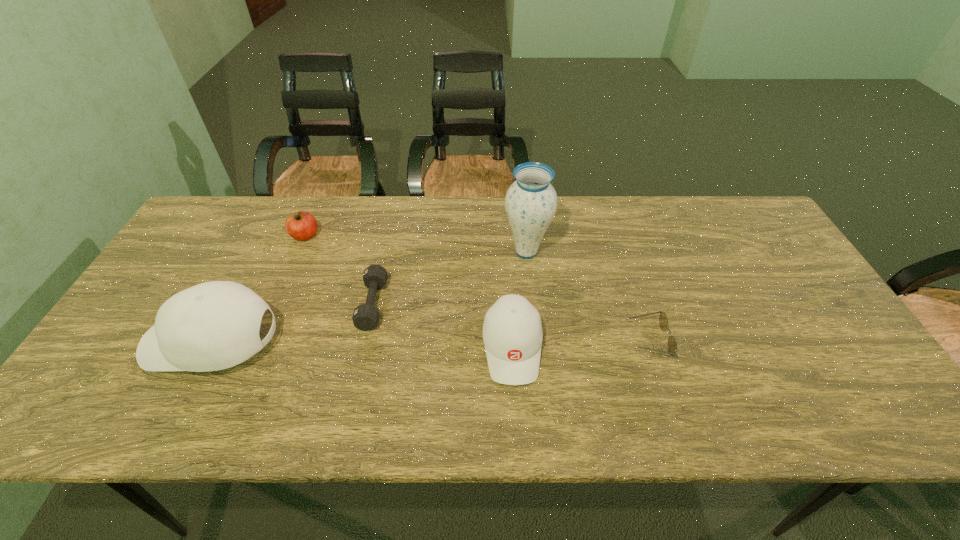
Where is `vacant place for an extra baseball cap on the right`? vacant place for an extra baseball cap on the right is located at coordinates (818, 353).